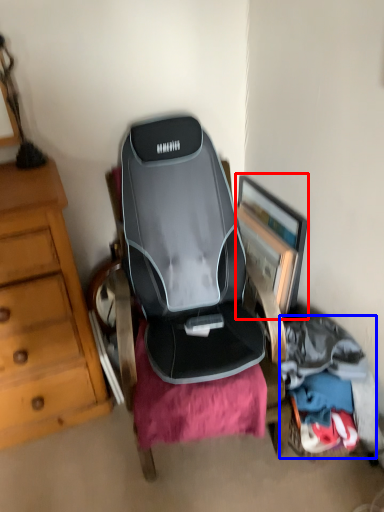
Question: Which object appears farthest to the camera in this image, picture frame (highlighted by a red box) or clothing (highlighted by a blue box)?

Choices:
 (A) picture frame
 (B) clothing

Answer: (A)